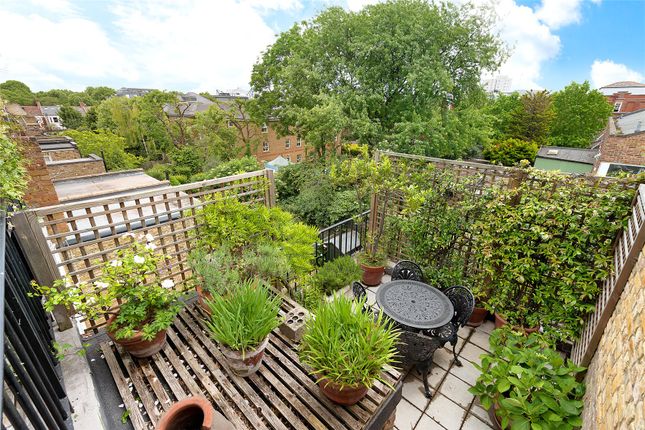
Where is `chair`? chair is located at coordinates (419, 356), (461, 317), (408, 277), (360, 297).